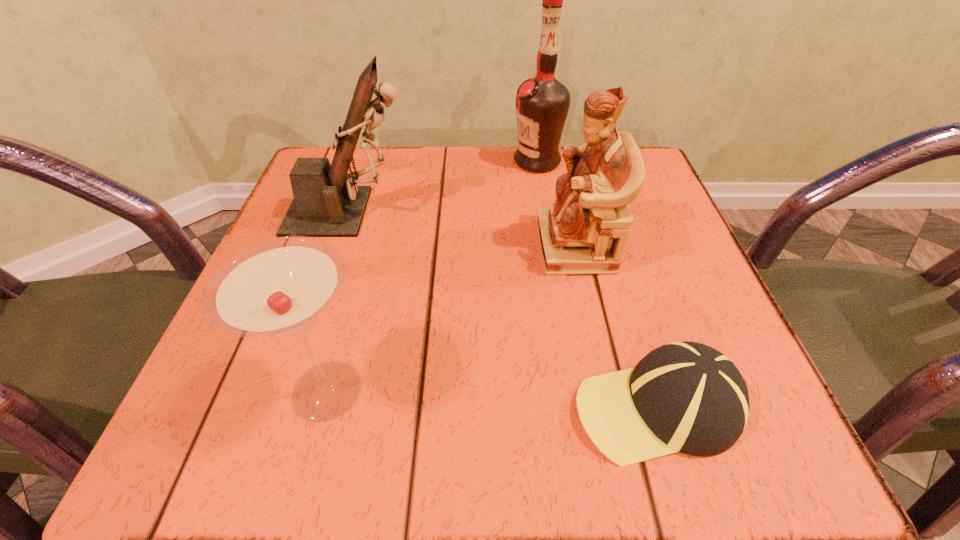
The height and width of the screenshot is (540, 960). In order to click on free space at the right edge of the desktop in this screenshot , I will do `click(730, 340)`.

Find the location of a particular element. vacant space at the far right corner of the desktop is located at coordinates (660, 185).

This screenshot has height=540, width=960. What are the coordinates of `free area in between the liquor and the left figurine` in the screenshot? It's located at (444, 186).

The image size is (960, 540). What are the coordinates of `free space that is in between the second shortest object and the right figurine` in the screenshot? It's located at (451, 319).

Find the location of a particular element. The width and height of the screenshot is (960, 540). free area in between the fourth tallest object and the left figurine is located at coordinates (339, 301).

You are a GUI agent. You are given a task and a screenshot of the screen. Output one action in this format:
    pyautogui.click(x=<x>, y=<y>)
    Task: Click on the empty space that is in between the baseball cap and the right figurine
    
    Given the screenshot: What is the action you would take?
    pyautogui.click(x=615, y=327)

Locate an element on the screen. free spot between the right figurine and the left figurine is located at coordinates (463, 229).

In order to click on free spot between the right figurine and the baseball cap in this screenshot , I will do `click(615, 327)`.

At what (x,y) coordinates should I click in order to perform the action: click on empty space between the liquor and the left figurine. Please return your answer as a coordinate pair (x, y). This screenshot has height=540, width=960. Looking at the image, I should click on (444, 186).

Where is `free point between the martini and the liquor`? This screenshot has height=540, width=960. free point between the martini and the liquor is located at coordinates (432, 276).